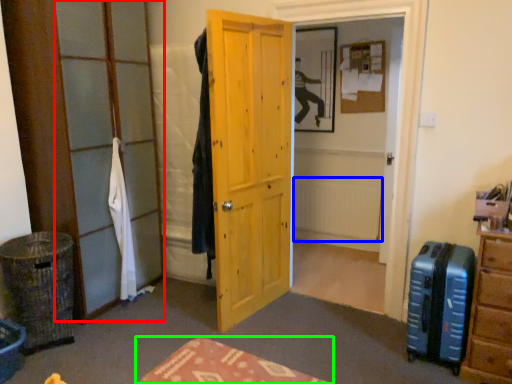
Question: Considering the real-world distances, which object is closest to glass door (highlighted by a red box)? radiator (highlighted by a blue box) or furniture (highlighted by a green box).

Choices:
 (A) radiator
 (B) furniture

Answer: (B)